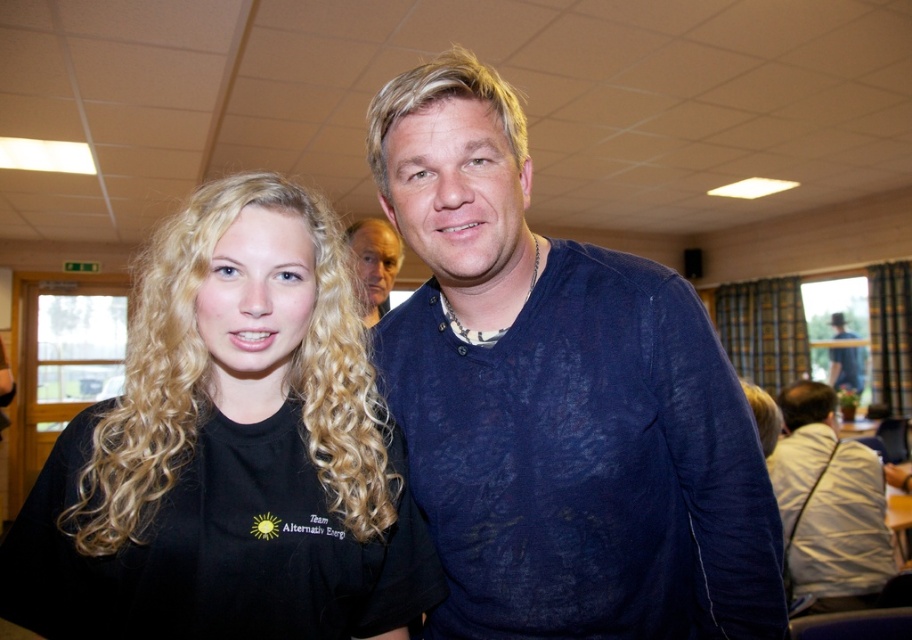
Question: Can you confirm if light beige fabric shirt at right is wider than dark blue shirt at upper right?

Choices:
 (A) yes
 (B) no

Answer: (A)

Question: Does matte black shirt at center have a larger size compared to dark blue shirt at upper right?

Choices:
 (A) no
 (B) yes

Answer: (B)

Question: Among these points, which one is farthest from the camera?

Choices:
 (A) (504, 188)
 (B) (149, 435)
 (C) (838, 348)

Answer: (C)

Question: Which object appears closest to the camera in this image?

Choices:
 (A) dark blue shirt at upper right
 (B) light beige fabric shirt at right
 (C) matte black shirt at center
 (D) blue cotton shirt at center

Answer: (D)

Question: Is blue cotton shirt at center behind black matte shirt at left?

Choices:
 (A) yes
 (B) no

Answer: (A)

Question: Which object is positioned closest to the black matte shirt at left?

Choices:
 (A) dark blue shirt at upper right
 (B) blue cotton shirt at center
 (C) matte black shirt at center

Answer: (B)